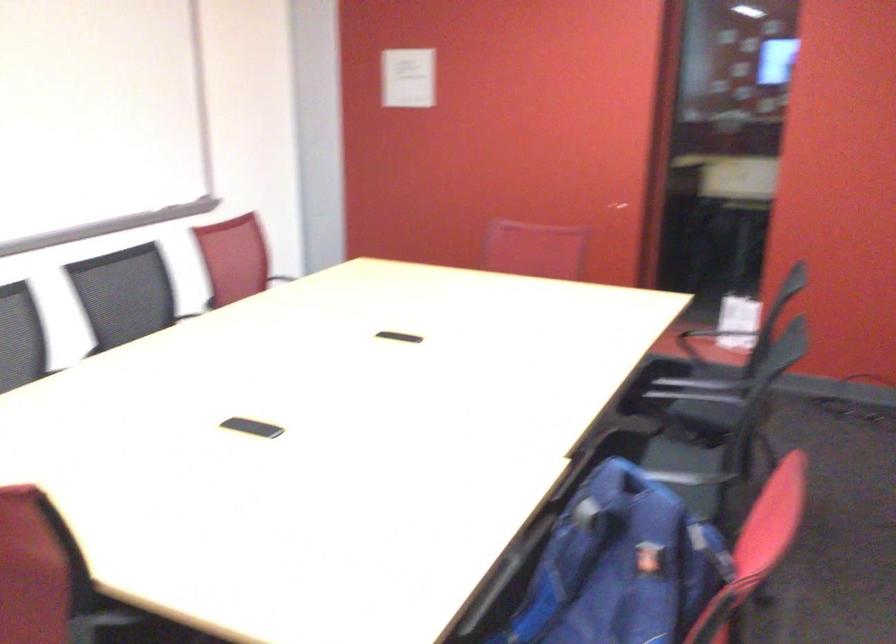
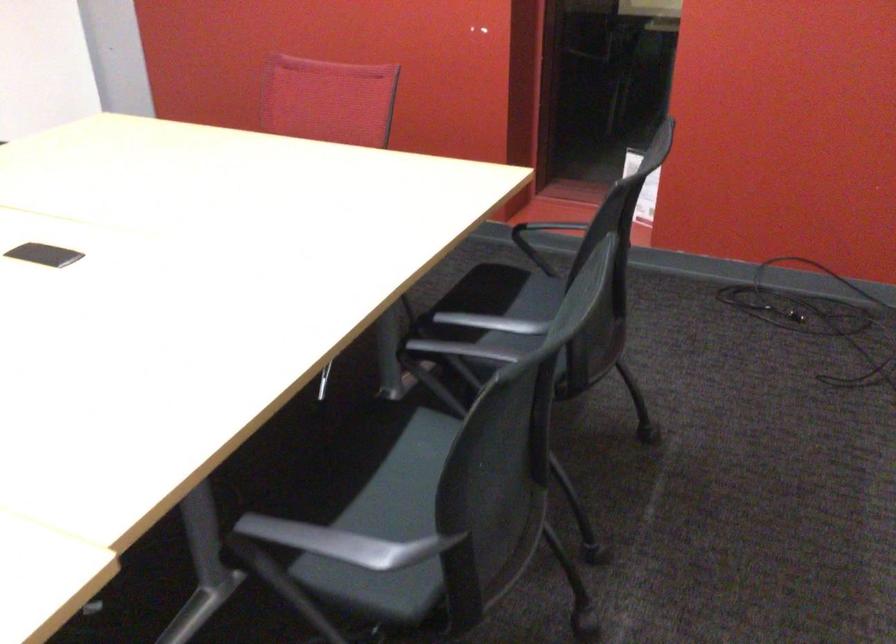
Which direction would the cameraman need to move to produce the second image?

The cameraman moved toward right, forward.